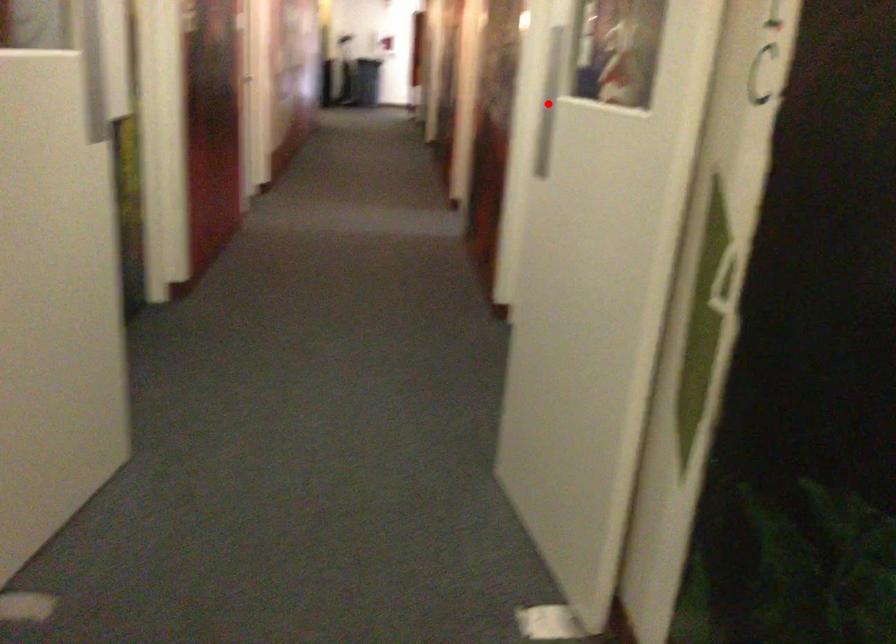
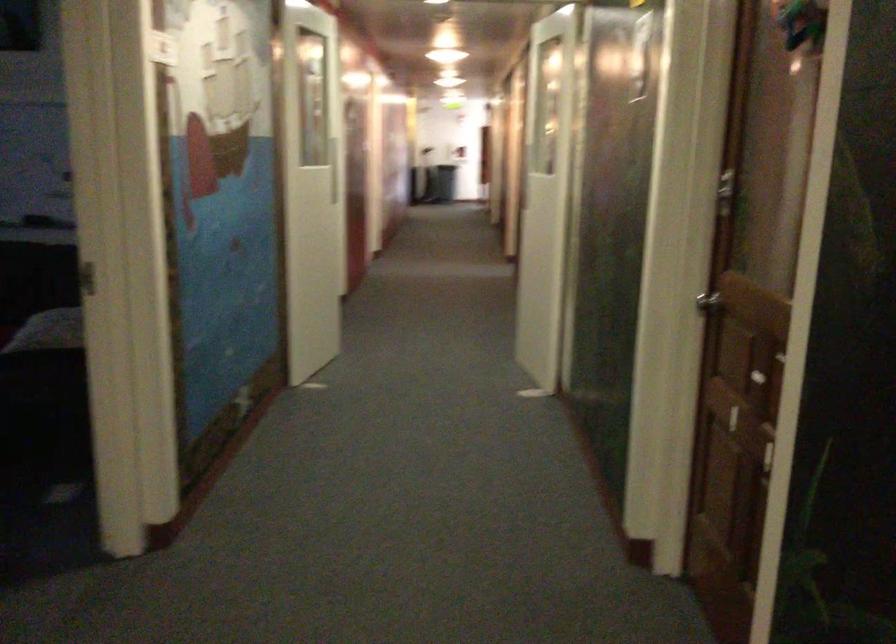
Question: I am providing you with two images of the same scene from different viewpoints. A red point is marked on the first image. Is the red point's position out of view in image 2?

Choices:
 (A) Yes
 (B) No

Answer: (A)